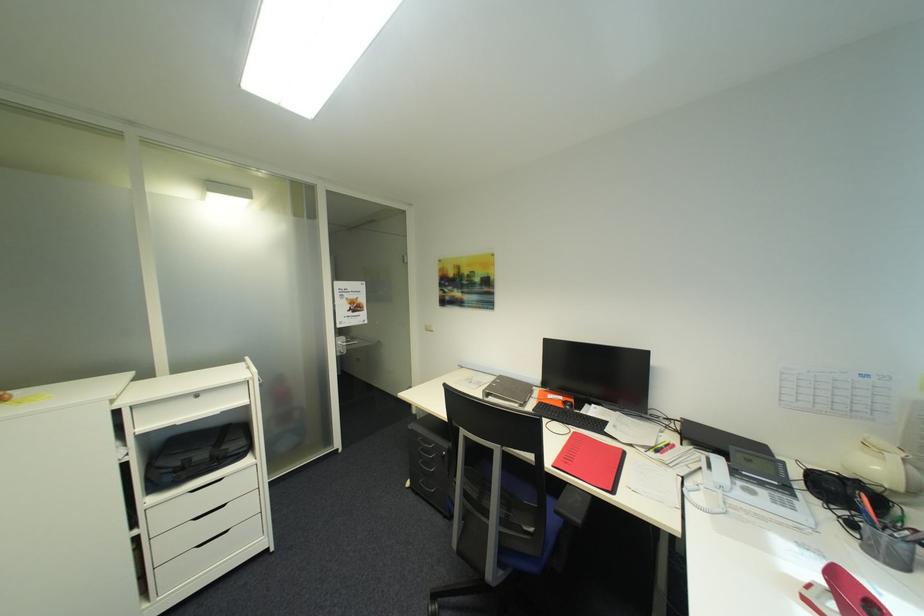
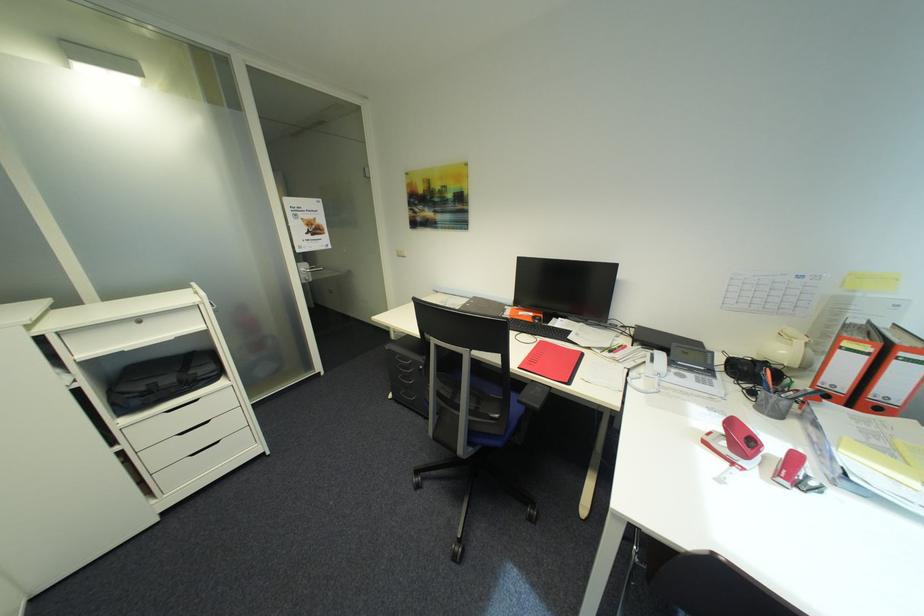
Find the pixel in the second image that matches (x=576, y=437) in the first image.

(542, 345)